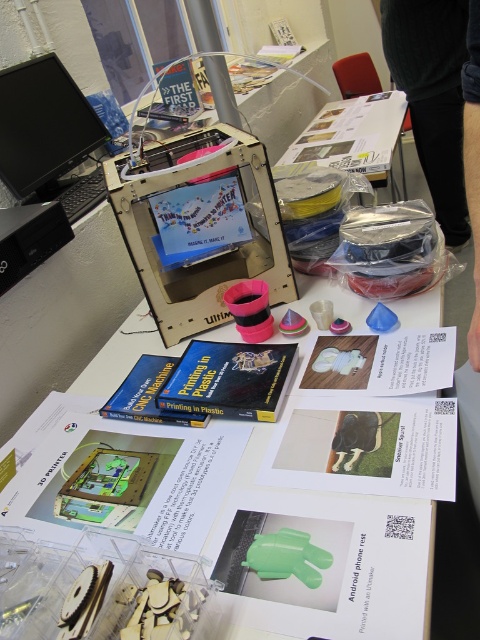
Question: Can you confirm if black sweater at upper right is positioned to the right of black glossy monitor at upper left?

Choices:
 (A) no
 (B) yes

Answer: (B)

Question: Among these objects, which one is farthest from the camera?

Choices:
 (A) black sweater at upper right
 (B) matte plastic 3d printer at center
 (C) black plastic keyboard at left

Answer: (A)

Question: Is black glossy monitor at upper left to the left of translucent plastic table at upper center from the viewer's perspective?

Choices:
 (A) yes
 (B) no

Answer: (A)

Question: Which point is farther to the camera?

Choices:
 (A) (475, 65)
 (B) (54, 84)

Answer: (B)

Question: Can you confirm if black sweater at upper right is smaller than matte plastic 3d printer at center?

Choices:
 (A) no
 (B) yes

Answer: (B)

Question: Which is nearer to the black glossy monitor at upper left?

Choices:
 (A) translucent plastic table at upper center
 (B) black fabric pants at lower right

Answer: (A)